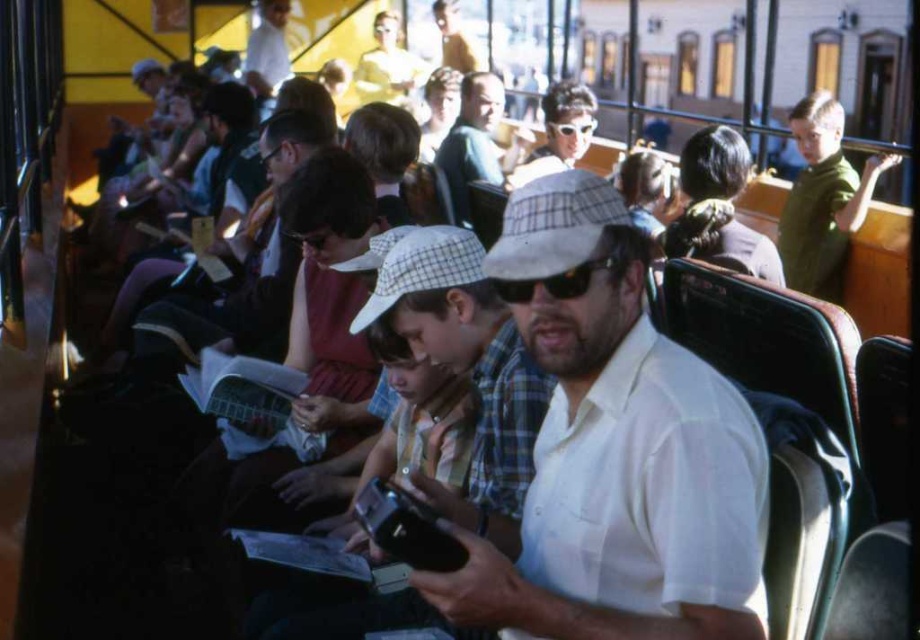
Question: Considering the real-world distances, which object is farthest from the matte black sunglasses at upper center?

Choices:
 (A) white checkered baseball hat at center
 (B) matte white hat at center
 (C) black plastic sunglasses at center
 (D) white checkered baseball cap at center

Answer: (C)

Question: Which of the following is the closest to the observer?

Choices:
 (A) matte white hat at center
 (B) white cotton shirt at upper center

Answer: (A)

Question: Does white checkered baseball cap at center have a lesser width compared to white cotton shirt at upper center?

Choices:
 (A) yes
 (B) no

Answer: (A)

Question: Is white checkered baseball cap at center bigger than matte black sunglasses at upper center?

Choices:
 (A) yes
 (B) no

Answer: (B)

Question: Observing the image, what is the correct spatial positioning of white cotton shirt at center in reference to white checkered baseball hat at center?

Choices:
 (A) below
 (B) above

Answer: (A)

Question: Which object is farther from the camera taking this photo?

Choices:
 (A) matte black sunglasses at upper center
 (B) white checkered baseball hat at center
 (C) matte black book at center

Answer: (A)